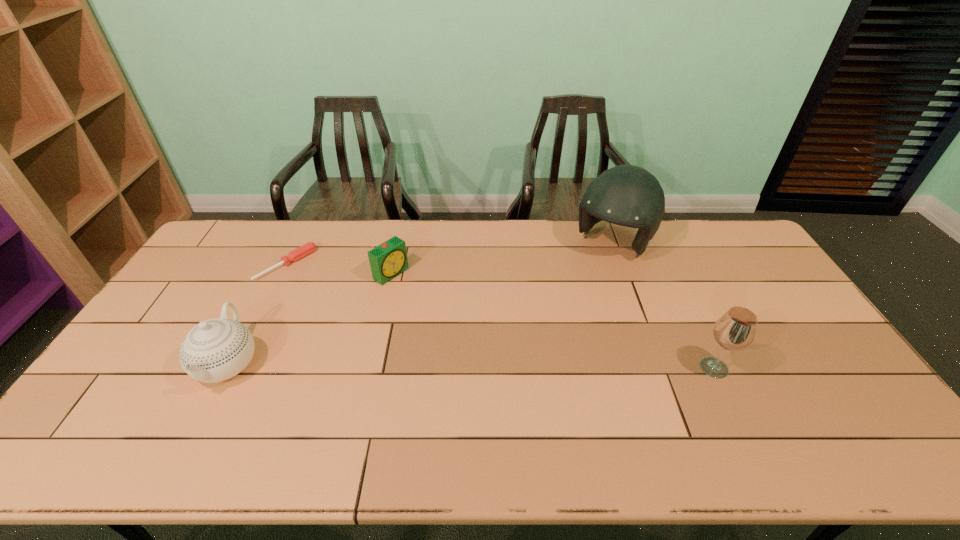
At what (x,y) coordinates should I click in order to perform the action: click on vacant point located between the third shortest object and the football helmet. Please return your answer as a coordinate pair (x, y). The height and width of the screenshot is (540, 960). Looking at the image, I should click on (420, 303).

Locate an element on the screen. The width and height of the screenshot is (960, 540). free space between the alarm clock and the wineglass is located at coordinates (552, 321).

At what (x,y) coordinates should I click in order to perform the action: click on free spot between the fourth tallest object and the tallest object. Please return your answer as a coordinate pair (x, y). Looking at the image, I should click on (502, 258).

In order to click on object that is the closest to the third shortest object in this screenshot , I will do `click(302, 251)`.

Image resolution: width=960 pixels, height=540 pixels. In order to click on the third closest object to the screwdriver in this screenshot , I will do `click(627, 195)`.

Where is `vacant position in the image that satisfies the following two spatial constraints: 1. on the front side of the shortest object; 2. on the right side of the third object from left to right`? The image size is (960, 540). vacant position in the image that satisfies the following two spatial constraints: 1. on the front side of the shortest object; 2. on the right side of the third object from left to right is located at coordinates (282, 274).

This screenshot has height=540, width=960. I want to click on vacant space that satisfies the following two spatial constraints: 1. on the front side of the second tallest object; 2. on the right side of the screwdriver, so click(234, 368).

I want to click on vacant space that satisfies the following two spatial constraints: 1. on the spout of the second tallest object; 2. on the right side of the chinaware, so click(x=227, y=368).